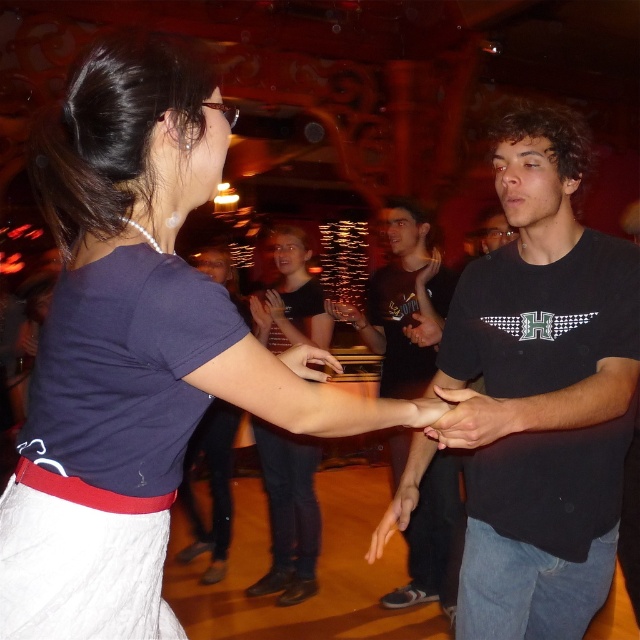
Which is in front, point (35, 566) or point (328, 340)?

Point (35, 566) is more forward.

Between matte blue shirt at center and matte black shirt at center, which one is positioned lower?

Positioned lower is matte black shirt at center.

Is point (44, 561) farther from camera compared to point (301, 467)?

No.

The width and height of the screenshot is (640, 640). In order to click on matte blue shirt at center in this screenshot , I will do `click(136, 349)`.

Which is more to the left, matte blue shirt at center or black cotton shirt at center?

matte blue shirt at center is more to the left.

Does matte blue shirt at center have a greater height compared to black cotton shirt at center?

Incorrect, matte blue shirt at center's height is not larger of black cotton shirt at center's.

Describe the element at coordinates (136, 349) in the screenshot. This screenshot has height=640, width=640. I see `matte blue shirt at center` at that location.

Identify the location of matte blue shirt at center. (136, 349).

Does black cotton shirt at center appear over matte black shirt at center?

Indeed, black cotton shirt at center is positioned over matte black shirt at center.

Image resolution: width=640 pixels, height=640 pixels. In order to click on black cotton shirt at center in this screenshot , I will do `click(403, 304)`.

Who is more forward, (362,320) or (308,296)?

Point (362,320) is in front.

This screenshot has height=640, width=640. What are the coordinates of `black cotton shirt at center` in the screenshot? It's located at (403, 304).